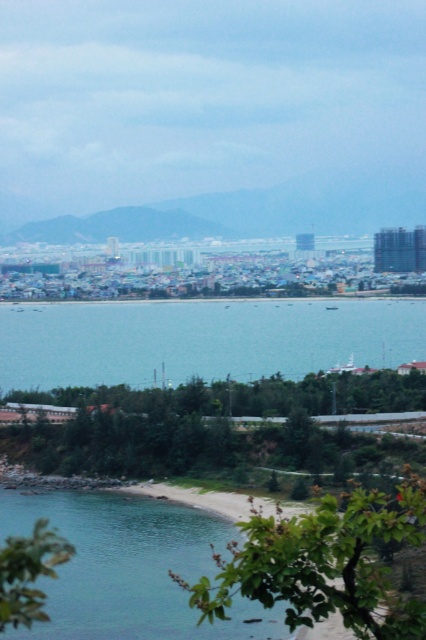
Question: Which point is closer to the camera?

Choices:
 (A) clear water at beach lower left
 (B) clear blue water at center

Answer: (A)

Question: Can you confirm if clear blue water at center is wider than clear water at beach lower left?

Choices:
 (A) no
 (B) yes

Answer: (B)

Question: Among these points, which one is nearest to the camera?

Choices:
 (A) (66, 596)
 (B) (22, 333)

Answer: (A)

Question: Can you confirm if clear blue water at center is smaller than clear water at beach lower left?

Choices:
 (A) no
 (B) yes

Answer: (A)

Question: Which object appears closest to the camera in this image?

Choices:
 (A) clear water at beach lower left
 (B) clear blue water at center

Answer: (A)

Question: Does clear blue water at center have a greater width compared to clear water at beach lower left?

Choices:
 (A) no
 (B) yes

Answer: (B)